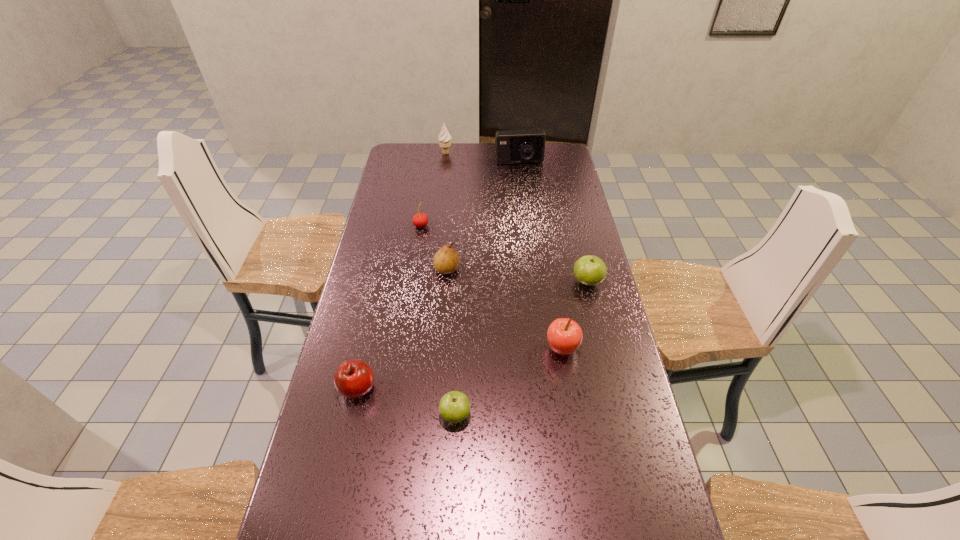
You are a GUI agent. You are given a task and a screenshot of the screen. Output one action in this format:
    pyautogui.click(x=<x>, y=<y>)
    Task: Click on the vacant point located between the nearer green apple and the farthest apple
    The image size is (960, 540).
    Given the screenshot: What is the action you would take?
    pyautogui.click(x=521, y=348)

Find the location of a particular element. This screenshot has height=540, width=960. vacant space that is in between the farther green apple and the farther pink apple is located at coordinates [x=574, y=315].

Identify which object is the nearest to the farthest object. Please provide its 2D coordinates. Your answer should be formatted as a tuple, i.e. [(x, y)], where the tuple contains the x and y coordinates of a point satisfying the conditions above.

[(512, 146)]

At what (x,y) coordinates should I click in order to perform the action: click on object that is the nearest to the second farthest apple. Please return your answer as a coordinate pair (x, y). The height and width of the screenshot is (540, 960). Looking at the image, I should click on (589, 270).

Locate which apple is the third closest to the blue camera. Please provide its 2D coordinates. Your answer should be formatted as a tuple, i.e. [(x, y)], where the tuple contains the x and y coordinates of a point satisfying the conditions above.

[(353, 378)]

The image size is (960, 540). In order to click on apple that stands as the second closest to the nearer green apple in this screenshot , I will do `click(564, 335)`.

Point out which pink apple is positioned as the nearest to the seventh nearest object. Please provide its 2D coordinates. Your answer should be formatted as a tuple, i.e. [(x, y)], where the tuple contains the x and y coordinates of a point satisfying the conditions above.

[(564, 335)]

The image size is (960, 540). I want to click on pink apple identified as the second closest to the shortest object, so click(x=564, y=335).

Identify the location of blank area in the image that satisfies the following two spatial constraints: 1. on the back side of the left pink apple; 2. on the left side of the second farthest apple. (366, 349).

This screenshot has height=540, width=960. Find the location of `free spot that satisfies the following two spatial constraints: 1. on the front-facing side of the shortest apple; 2. on the right side of the icecream`. free spot that satisfies the following two spatial constraints: 1. on the front-facing side of the shortest apple; 2. on the right side of the icecream is located at coordinates (418, 415).